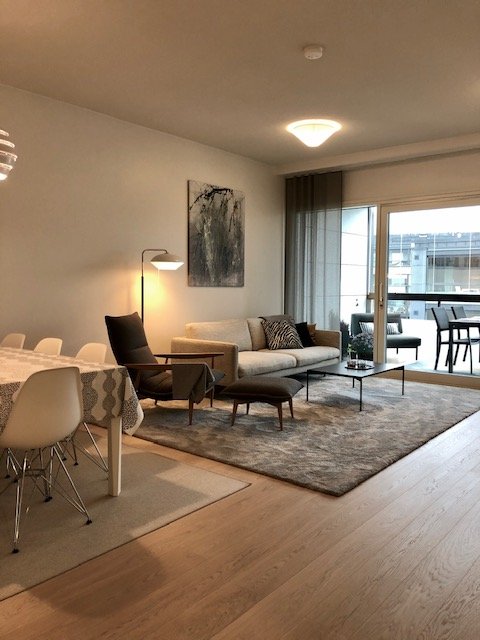
Where is `silver chair legs`? The image size is (480, 640). silver chair legs is located at coordinates (41, 476), (71, 436).